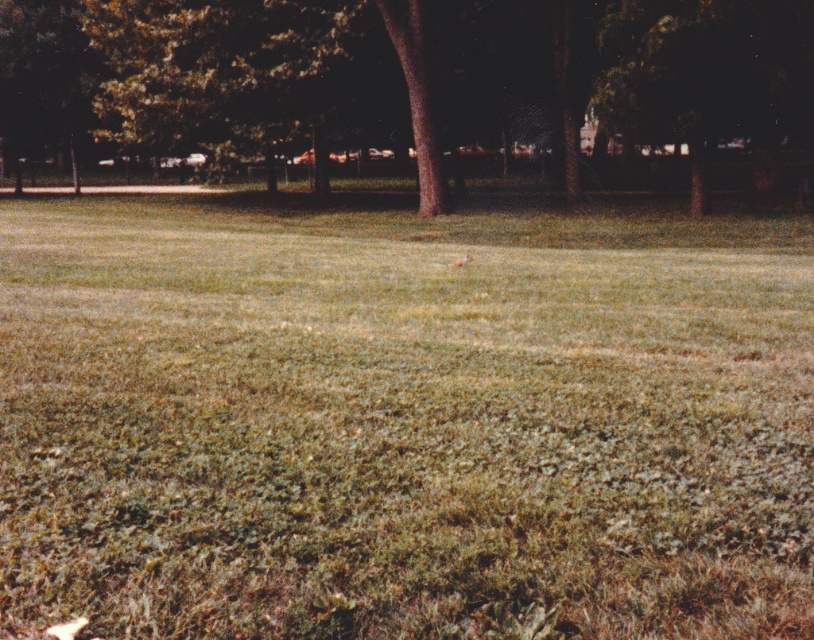
Who is more distant from viewer, (x=338, y=228) or (x=397, y=36)?

The point (x=397, y=36) is behind.

Does green grassy field at center appear under brown rough bark tree at center?

Indeed, green grassy field at center is positioned under brown rough bark tree at center.

Who is more forward, (193, 257) or (408, 52)?

Positioned in front is point (193, 257).

The width and height of the screenshot is (814, 640). Identify the location of green grassy field at center. (403, 422).

Is point (305, 579) behind point (703, 205)?

No, it is in front of (703, 205).

Is green grassy field at center bigger than green leafy tree at center?

No.

Image resolution: width=814 pixels, height=640 pixels. Describe the element at coordinates (403, 422) in the screenshot. I see `green grassy field at center` at that location.

You are a GUI agent. You are given a task and a screenshot of the screen. Output one action in this format:
    pyautogui.click(x=<x>, y=<y>)
    Task: Click on the green grassy field at center
    
    Given the screenshot: What is the action you would take?
    pyautogui.click(x=403, y=422)

Does green grassy field at center have a lesser height compared to brown textured tree at center?

Correct, green grassy field at center is not as tall as brown textured tree at center.

Can you confirm if green grassy field at center is positioned above brown textured tree at center?

No.

Is point (444, 512) closer to camera compared to point (20, 115)?

Yes, it is.

This screenshot has width=814, height=640. In order to click on green grassy field at center in this screenshot , I will do `click(403, 422)`.